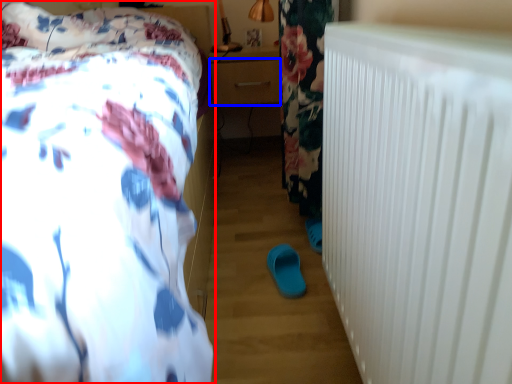
Question: Which object is further to the camera taking this photo, bed (highlighted by a red box) or drawer (highlighted by a blue box)?

Choices:
 (A) bed
 (B) drawer

Answer: (B)